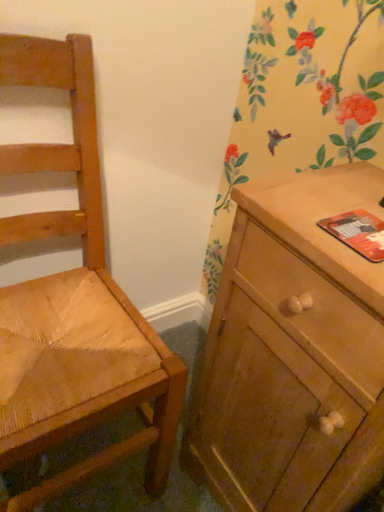
Identify the location of orange matte paperback book at right. The width and height of the screenshot is (384, 512). (358, 233).

This screenshot has height=512, width=384. Describe the element at coordinates (292, 352) in the screenshot. I see `wooden cabinet at right` at that location.

Find the location of a particular element. light brown woven wood chair at left is located at coordinates pos(74,305).

From the picture: From a real-world perspective, is orange matte paperback book at right above or below wooden cabinet at right?

From a real-world perspective, orange matte paperback book at right is physically above wooden cabinet at right.

Is orange matte paperback book at right in contact with wooden cabinet at right?

No, orange matte paperback book at right is not in contact with wooden cabinet at right.

Is orange matte paperback book at right turned away from wooden cabinet at right?

Yes.

Is point (365, 211) in front of point (243, 247)?

Yes, point (365, 211) is closer to viewer.

Is orange matte paperback book at right at the back of wooden cabinet at right?

No, wooden cabinet at right's orientation is not away from orange matte paperback book at right.

Which is more to the right, wooden cabinet at right or orange matte paperback book at right?

orange matte paperback book at right is more to the right.

Considering the positions of point (266, 304) and point (347, 238), is point (266, 304) closer or farther from the camera than point (347, 238)?

Point (266, 304) appears to be farther away from the viewer than point (347, 238).

Are wooden cabinet at right and orange matte paperback book at right beside each other?

They are not placed beside each other.

In terms of width, does orange matte paperback book at right look wider or thinner when compared to light brown woven wood chair at left?

In the image, orange matte paperback book at right appears to be more narrow than light brown woven wood chair at left.

Between orange matte paperback book at right and light brown woven wood chair at left, which one has smaller size?

orange matte paperback book at right.

Could you tell me if orange matte paperback book at right is facing light brown woven wood chair at left?

No.

Is orange matte paperback book at right positioned in front of light brown woven wood chair at left?

No, orange matte paperback book at right is behind light brown woven wood chair at left.

Is wooden cabinet at right thinner than light brown woven wood chair at left?

Yes, wooden cabinet at right is thinner than light brown woven wood chair at left.

Is wooden cabinet at right touching light brown woven wood chair at left?

No, wooden cabinet at right is not with light brown woven wood chair at left.

Can you tell me how much wooden cabinet at right and light brown woven wood chair at left differ in facing direction?

They differ by 89.6 degrees in their facing directions.

From a real-world perspective, is wooden cabinet at right below light brown woven wood chair at left?

Yes, from a real-world perspective, wooden cabinet at right is below light brown woven wood chair at left.

Can you confirm if light brown woven wood chair at left is wider than wooden cabinet at right?

Yes, light brown woven wood chair at left is wider than wooden cabinet at right.

Is the surface of light brown woven wood chair at left in direct contact with wooden cabinet at right?

No, light brown woven wood chair at left is not making contact with wooden cabinet at right.

In the scene shown: How many degrees apart are the facing directions of light brown woven wood chair at left and wooden cabinet at right?

The angle between the facing direction of light brown woven wood chair at left and the facing direction of wooden cabinet at right is 89.6 degrees.

Is light brown woven wood chair at left positioned far away from orange matte paperback book at right?

They are positioned close to each other.

Can you confirm if light brown woven wood chair at left is wider than orange matte paperback book at right?

Correct, the width of light brown woven wood chair at left exceeds that of orange matte paperback book at right.

Which object is positioned more to the left, light brown woven wood chair at left or orange matte paperback book at right?

Positioned to the left is light brown woven wood chair at left.

Is light brown woven wood chair at left oriented away from orange matte paperback book at right?

No, light brown woven wood chair at left is not facing away from orange matte paperback book at right.

Where is `paperback book above the wooden cabinet at right (from the image's perspective)`? This screenshot has width=384, height=512. paperback book above the wooden cabinet at right (from the image's perspective) is located at coordinates (358, 233).

Identify the location of paperback book behind the wooden cabinet at right. (358, 233).

Looking at the image, which one is located closer to wooden cabinet at right, light brown woven wood chair at left or orange matte paperback book at right?

light brown woven wood chair at left is positioned closer to the anchor wooden cabinet at right.

Estimate the real-world distances between objects in this image. Which object is further from light brown woven wood chair at left, wooden cabinet at right or orange matte paperback book at right?

orange matte paperback book at right is further to light brown woven wood chair at left.

When comparing their distances from light brown woven wood chair at left, does orange matte paperback book at right or wooden cabinet at right seem closer?

wooden cabinet at right is closer to light brown woven wood chair at left.

Based on their spatial positions, is orange matte paperback book at right or light brown woven wood chair at left closer to wooden cabinet at right?

The object closer to wooden cabinet at right is light brown woven wood chair at left.

From the image, which object appears to be farther from orange matte paperback book at right, wooden cabinet at right or light brown woven wood chair at left?

Among the two, light brown woven wood chair at left is located further to orange matte paperback book at right.

Estimate the real-world distances between objects in this image. Which object is closer to orange matte paperback book at right, light brown woven wood chair at left or wooden cabinet at right?

wooden cabinet at right.

Identify the location of the chest of drawers located between light brown woven wood chair at left and orange matte paperback book at right in the left-right direction. The image size is (384, 512). (292, 352).